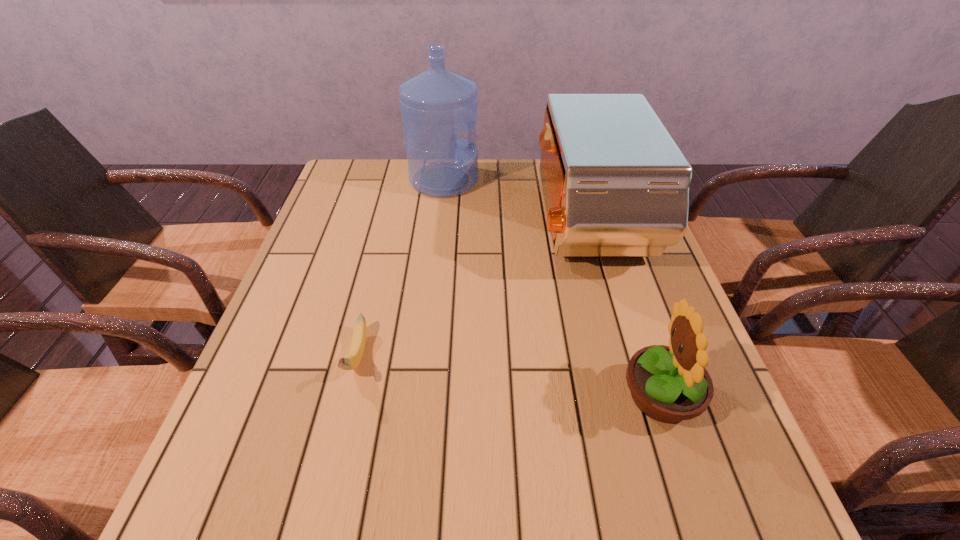
At what (x,y) coordinates should I click in order to perform the action: click on free point located 0.250m on the face of the third tallest object. Please return your answer as a coordinate pair (x, y). Looking at the image, I should click on (491, 395).

Locate an element on the screen. The height and width of the screenshot is (540, 960). blank space located on the face of the third tallest object is located at coordinates (422, 395).

Locate an element on the screen. vacant region located on the face of the third tallest object is located at coordinates (527, 395).

This screenshot has height=540, width=960. Find the location of `vacant space located at the stem of the leftmost object`. vacant space located at the stem of the leftmost object is located at coordinates (315, 529).

Find the location of `water jug positioned at the far edge`. water jug positioned at the far edge is located at coordinates (437, 104).

The height and width of the screenshot is (540, 960). I want to click on toaster oven that is at the far edge, so click(615, 183).

Find the location of a particular element. toaster oven that is at the right edge is located at coordinates (615, 183).

The width and height of the screenshot is (960, 540). I want to click on sunflower that is positioned at the right edge, so click(669, 384).

This screenshot has width=960, height=540. What are the coordinates of `object that is at the far right corner` in the screenshot? It's located at (615, 183).

The image size is (960, 540). What are the coordinates of `free spot at the far edge of the desktop` in the screenshot? It's located at (500, 197).